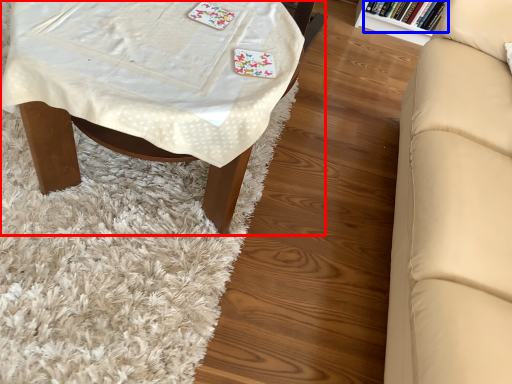
Question: Which point is closer to the camera, table (highlighted by a red box) or book (highlighted by a blue box)?

Choices:
 (A) table
 (B) book

Answer: (A)